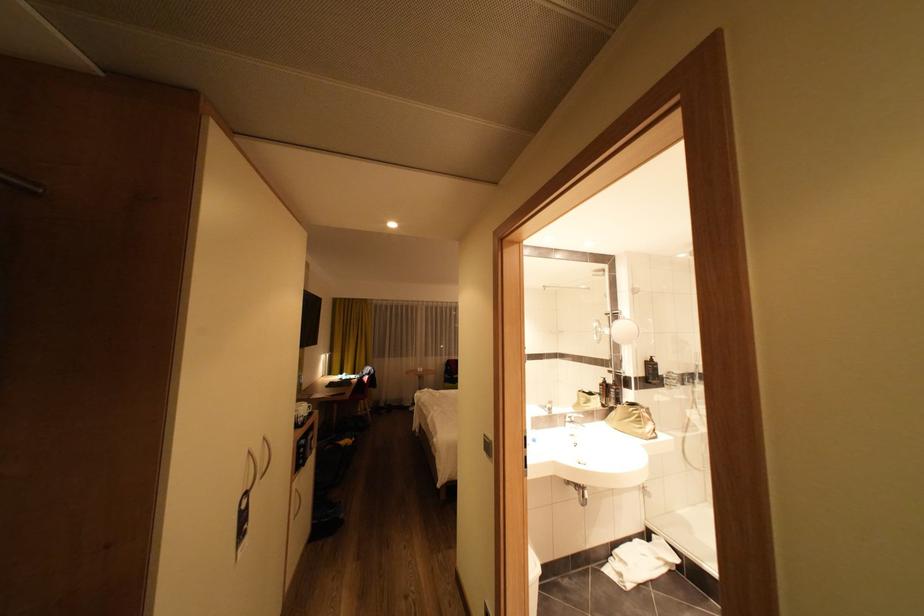
The image size is (924, 616). What do you see at coordinates (19, 182) in the screenshot?
I see `the metal bar handle` at bounding box center [19, 182].